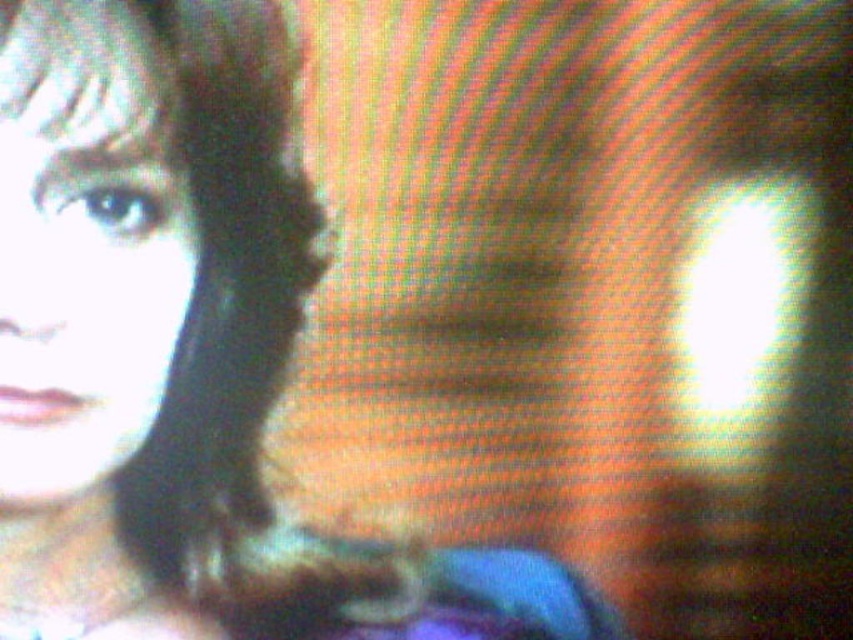
Can you confirm if matte black hair at upper left is positioned to the left of smooth black hair at upper left?

Incorrect, matte black hair at upper left is not on the left side of smooth black hair at upper left.

Can you confirm if matte black hair at upper left is shorter than smooth black hair at upper left?

No, matte black hair at upper left is not shorter than smooth black hair at upper left.

Is point (544, 605) farther from camera compared to point (131, 44)?

Yes, point (544, 605) is farther from viewer.

Identify the location of matte black hair at upper left. Image resolution: width=853 pixels, height=640 pixels. (184, 352).

Is point (186, 241) less distant than point (163, 260)?

No, (186, 241) is further to viewer.

Can you confirm if matte black hair at upper left is positioned to the right of smooth skin face at upper left?

Correct, you'll find matte black hair at upper left to the right of smooth skin face at upper left.

Looking at this image, who is more forward, (250, 448) or (144, 300)?

Positioned in front is point (144, 300).

Find the location of a particular element. matte black hair at upper left is located at coordinates (184, 352).

Does smooth skin face at upper left have a smaller size compared to smooth black hair at upper left?

No.

Describe the element at coordinates (84, 243) in the screenshot. I see `smooth skin face at upper left` at that location.

Is point (38, 33) positioned after point (94, 115)?

No, it is in front of (94, 115).

At what (x,y) coordinates should I click in order to perform the action: click on smooth skin face at upper left. Please return your answer as a coordinate pair (x, y). Looking at the image, I should click on (84, 243).